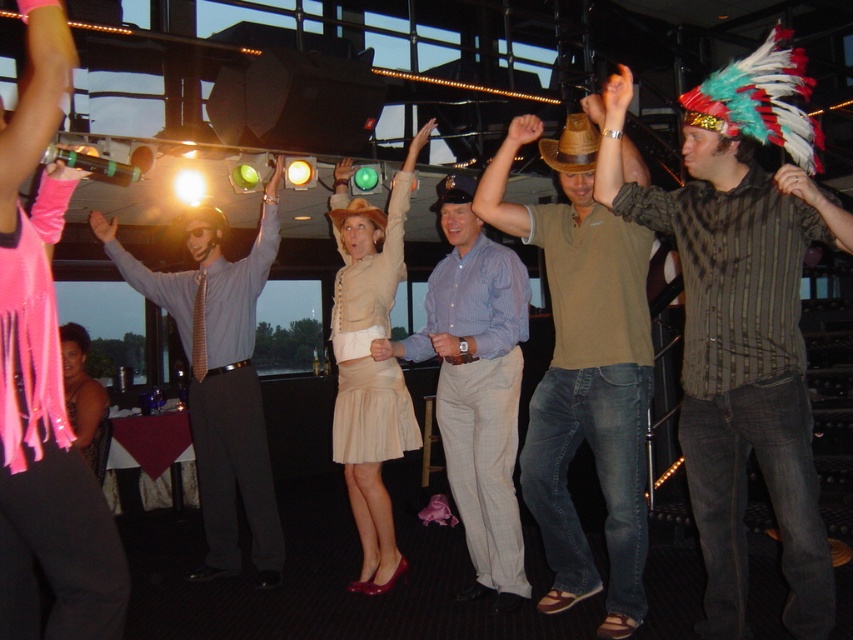
Between brown leather hand at upper center and matte gray shirt at upper center, which one appears on the right side from the viewer's perspective?

Positioned to the right is brown leather hand at upper center.

Is brown leather hand at upper center to the left of matte gray shirt at upper center from the viewer's perspective?

No, brown leather hand at upper center is not to the left of matte gray shirt at upper center.

Between point (535, 129) and point (106, 224), which one is positioned in front?

Point (535, 129) is more forward.

This screenshot has height=640, width=853. I want to click on brown leather hand at upper center, so click(x=523, y=131).

Between matte brown hat at center and blue striped shirt at center, which one appears on the left side from the viewer's perspective?

blue striped shirt at center

Identify the location of matte brown hat at center. (585, 371).

What do you see at coordinates (369, 369) in the screenshot? The width and height of the screenshot is (853, 640). I see `beige pleated skirt at center` at bounding box center [369, 369].

Does beige pleated skirt at center have a lesser height compared to white matte hand at center?

Incorrect, beige pleated skirt at center's height does not fall short of white matte hand at center's.

Is point (351, 204) in front of point (375, 349)?

No, (351, 204) is behind (375, 349).

Image resolution: width=853 pixels, height=640 pixels. I want to click on beige pleated skirt at center, so click(x=369, y=369).